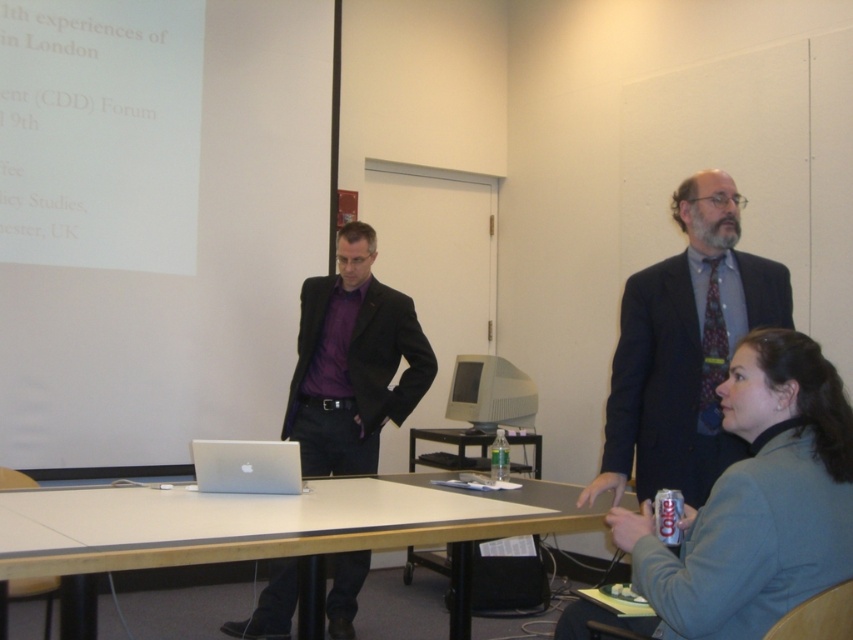
Can you confirm if matte black suit at center is smaller than silver metallic laptop at center?

Actually, matte black suit at center might be larger than silver metallic laptop at center.

Does point (305, 416) come behind point (296, 465)?

That is True.

Locate an element on the screen. The image size is (853, 640). matte black suit at center is located at coordinates (352, 362).

Which of these two, light brown wooden table at center or dark blue suit at right, stands shorter?

Standing shorter between the two is light brown wooden table at center.

Is point (71, 630) farther from viewer compared to point (670, 316)?

No, it is not.

Does point (213, 536) come closer to viewer compared to point (666, 294)?

Yes, point (213, 536) is closer to viewer.

Where is `light brown wooden table at center`? light brown wooden table at center is located at coordinates (264, 532).

Is light brown wooden table at center taller than matte black suit at center?

No.

Does light brown wooden table at center appear on the left side of matte black suit at center?

Incorrect, light brown wooden table at center is not on the left side of matte black suit at center.

Is point (434, 536) positioned before point (315, 400)?

Yes, it is.

Identify the location of light brown wooden table at center. The width and height of the screenshot is (853, 640). (264, 532).